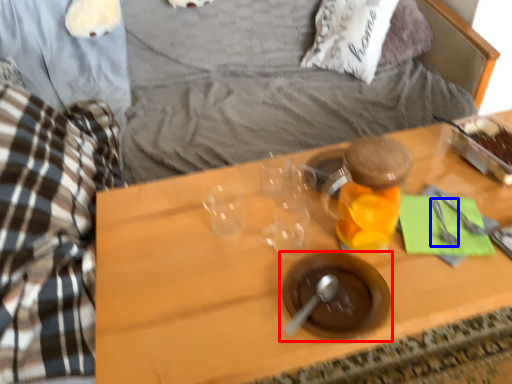
Question: Which of the following is the closest to the observer, tableware (highlighted by a red box) or silverware (highlighted by a blue box)?

Choices:
 (A) tableware
 (B) silverware

Answer: (A)